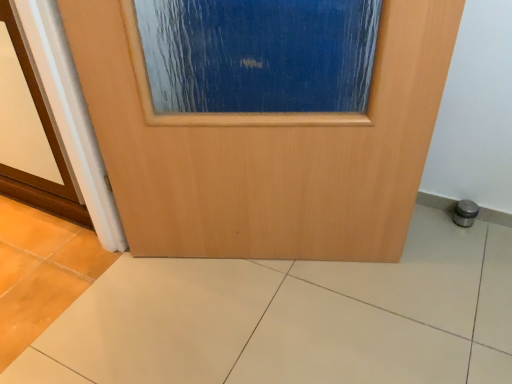
Where is `free space above beige ceramic tile at center (from a real-world perspective)`? Image resolution: width=512 pixels, height=384 pixels. free space above beige ceramic tile at center (from a real-world perspective) is located at coordinates (310, 305).